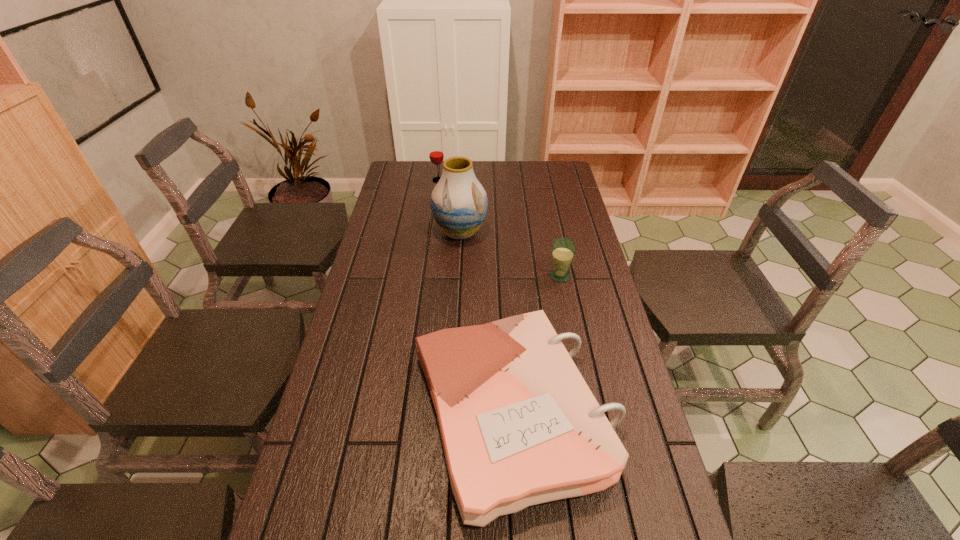
Where is `blank area in the image that satisfies the following two spatial constraints: 1. on the back side of the second nearest object; 2. on the left side of the nearest object`? This screenshot has height=540, width=960. blank area in the image that satisfies the following two spatial constraints: 1. on the back side of the second nearest object; 2. on the left side of the nearest object is located at coordinates (505, 275).